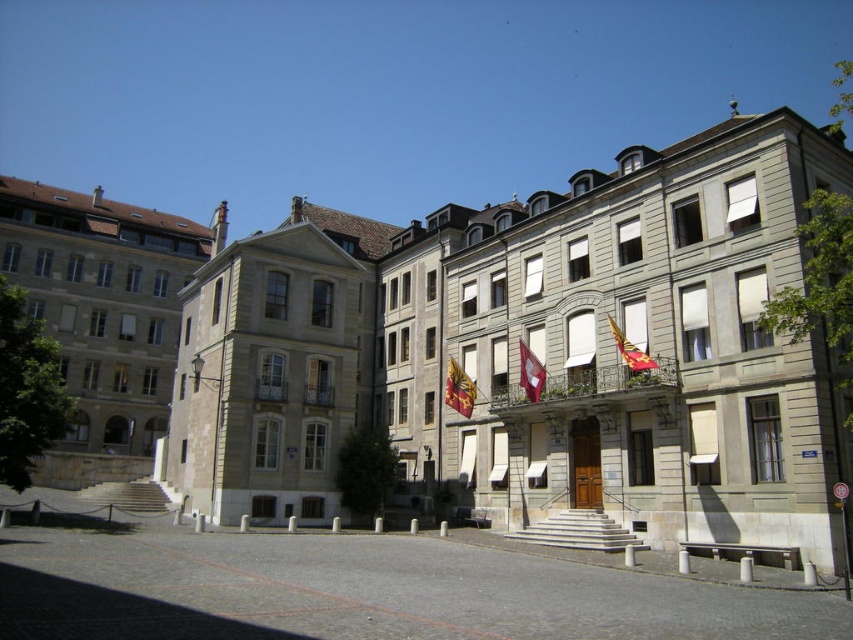
Looking at this image, you are standing in front of the historic building complex and want to locate the red fabric flag at center. Based on the coordinates provided, where would you find it?

The red fabric flag at center is located at coordinates point (531, 372).